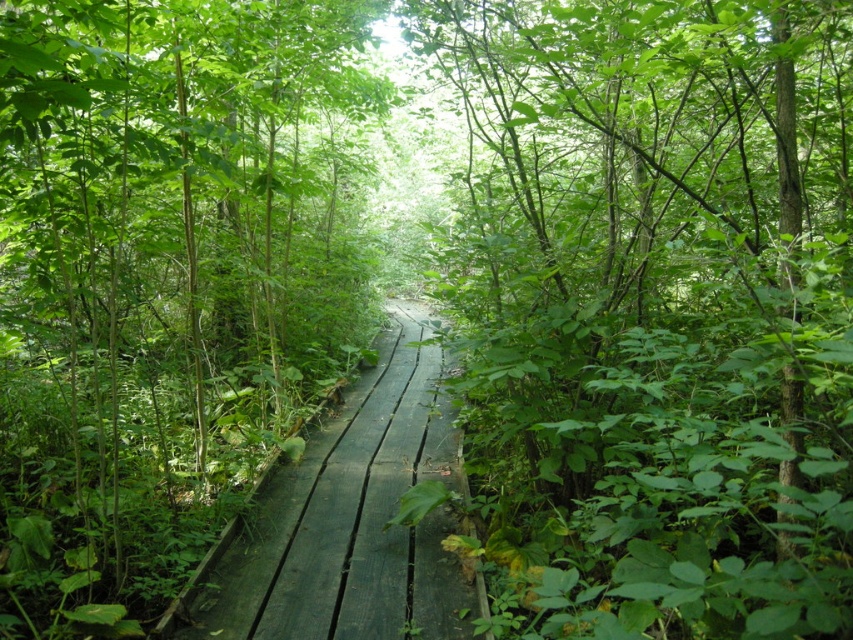
Question: Among these points, which one is nearest to the camera?

Choices:
 (A) (647, 394)
 (B) (430, 368)

Answer: (A)

Question: Which point is farther to the camera?

Choices:
 (A) (33, 196)
 (B) (408, 476)

Answer: (B)

Question: Is green leafy tree at center thinner than dark green wooden path at center?

Choices:
 (A) no
 (B) yes

Answer: (A)

Question: From the image, what is the correct spatial relationship of green matte wood at center in relation to dark green wooden path at center?

Choices:
 (A) left
 (B) right

Answer: (A)

Question: Does green leafy tree at center have a greater width compared to dark green wooden path at center?

Choices:
 (A) no
 (B) yes

Answer: (B)

Question: Which point is farther from the camera taking this photo?

Choices:
 (A) (169, 518)
 (B) (761, 602)
 (C) (410, 481)

Answer: (C)